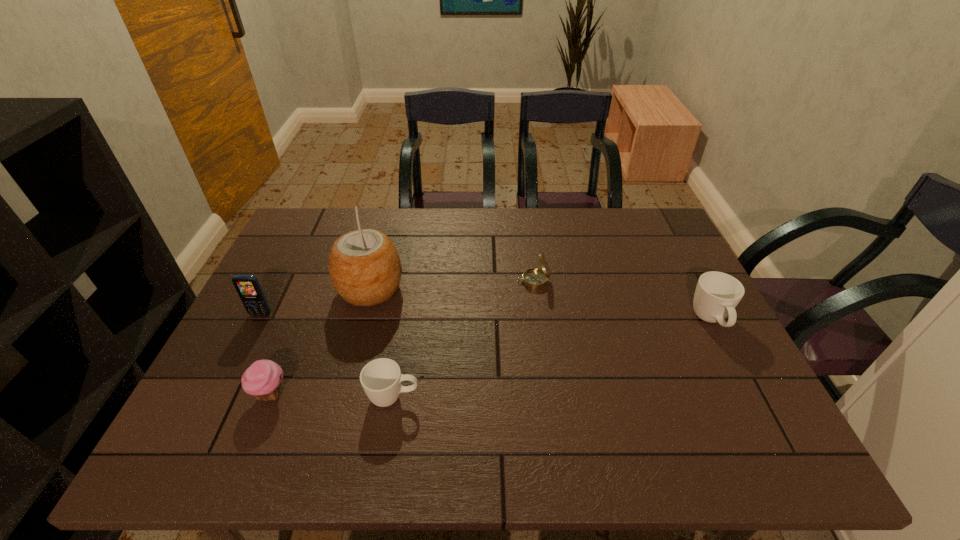
To ensure equal spacing by inserting another cup among them, please point out a vacant spot for this new cup. Please provide its 2D coordinates. Your answer should be formatted as a tuple, i.e. [(x, y)], where the tuple contains the x and y coordinates of a point satisfying the conditions above.

[(564, 356)]